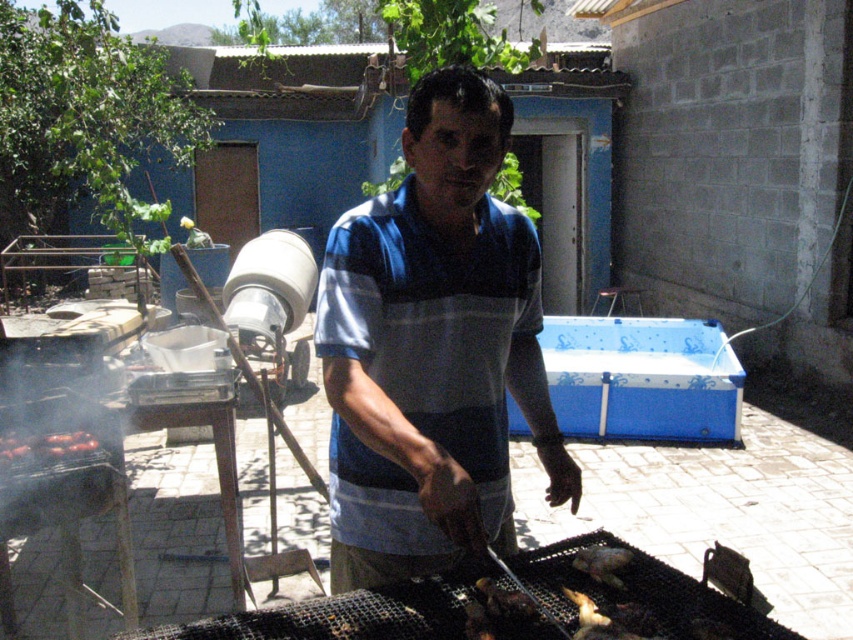
This screenshot has height=640, width=853. What do you see at coordinates (433, 348) in the screenshot?
I see `blue striped shirt at center` at bounding box center [433, 348].

Between point (535, 388) and point (71, 445), which one is positioned behind?

Point (71, 445)

Locate an element on the screen. The width and height of the screenshot is (853, 640). blue striped shirt at center is located at coordinates (433, 348).

Can you confirm if smoked red meat at lower left is smaller than charcoal grilled meat at center?

Actually, smoked red meat at lower left might be larger than charcoal grilled meat at center.

Does point (78, 436) come closer to viewer compared to point (610, 577)?

No, (78, 436) is further to viewer.

Is point (50, 436) closer to camera compared to point (605, 573)?

No, it is behind (605, 573).

Identify the location of smoked red meat at lower left. (45, 448).

Can you confirm if blue striped shirt at center is taller than charcoal grilled meat at center?

Yes, blue striped shirt at center is taller than charcoal grilled meat at center.

Does point (428, 221) come behind point (610, 564)?

No.

Which is behind, point (363, 289) or point (608, 563)?

The point (608, 563) is more distant.

Where is `blue striped shirt at center`? blue striped shirt at center is located at coordinates (433, 348).